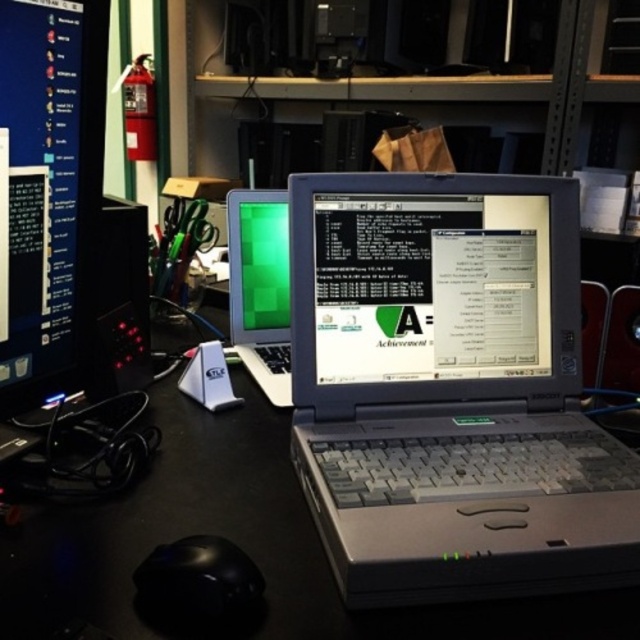
Based on the photo, you are setting up a new desk and want to place a plant between the matte black monitor at left and the green matte screen at center. According to the image, which monitor should the plant be placed in front of?

The matte black monitor at left is positioned over the green matte screen at center, so the plant should be placed in front of the green matte screen at center since it is lower and the plant would fit better there.

You are organizing a tech exhibition and need to arrange the matte black monitor at left and the green matte screen at center on a display table. Given their sizes, which one should you place first to ensure both fit properly?

The matte black monitor at left occupies less space than the green matte screen at center, so you should place the larger green matte screen at center first to ensure both fit properly.

You are setting up a new desk and want to place a new monitor exactly where the matte black monitor at left is currently located. What are the coordinates you should input into your desk layout software to position the new monitor?

The coordinates for the matte black monitor at left are at point (51, 189), so you should input these coordinates into your desk layout software to position the new monitor there.